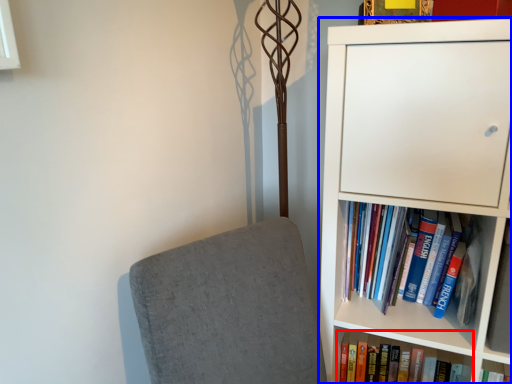
Question: Which of the following is the farthest to the observer, book (highlighted by a red box) or bookcase (highlighted by a blue box)?

Choices:
 (A) book
 (B) bookcase

Answer: (A)